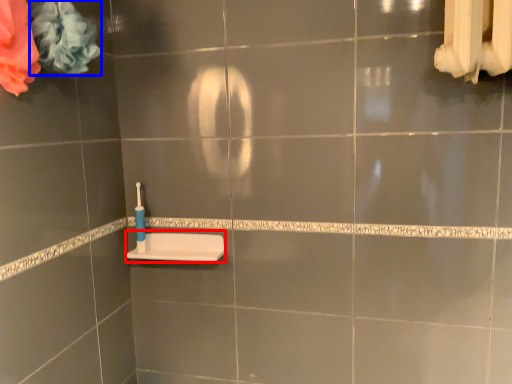
Question: Among these objects, which one is nearest to the camera, sink (highlighted by a red box) or flower (highlighted by a blue box)?

Choices:
 (A) sink
 (B) flower

Answer: (B)